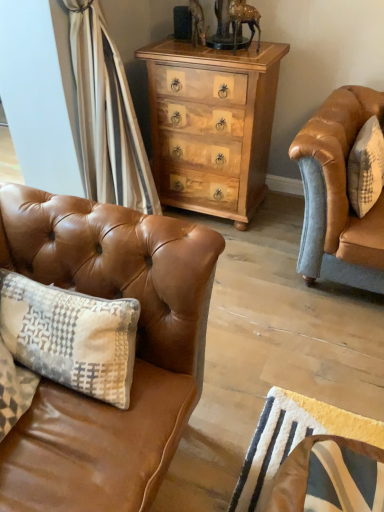
The image size is (384, 512). What do you see at coordinates (366, 167) in the screenshot?
I see `white textured pillow at right` at bounding box center [366, 167].

Describe the element at coordinates (136, 350) in the screenshot. I see `saddle brown leather couch at left` at that location.

What are the coordinates of `white textured pillow at right` in the screenshot? It's located at (366, 167).

Visually, is leather swivel chair at lower right positioned to the left or to the right of white textured pillow at right?

leather swivel chair at lower right is positioned on white textured pillow at right's left side.

Does point (344, 482) come closer to viewer compared to point (370, 187)?

Yes.

Does leather swivel chair at lower right have a lesser height compared to white textured pillow at right?

In fact, leather swivel chair at lower right may be taller than white textured pillow at right.

Can you tell me how much leather swivel chair at lower right and white textured pillow at right differ in facing direction?

4.36 degrees.

Is white textured pillow at right next to saddle brown leather couch at left?

white textured pillow at right is not next to saddle brown leather couch at left, and they're not touching.

Find the location of a particular element. The image size is (384, 512). studio couch lying on the left of white textured pillow at right is located at coordinates (136, 350).

Can you tell me how much white textured pillow at right and saddle brown leather couch at left differ in facing direction?

white textured pillow at right and saddle brown leather couch at left are facing 88.2 degrees away from each other.

Can saddle brown leather couch at left be found inside white textured pillow at right?

No, saddle brown leather couch at left is not surrounded by white textured pillow at right.

Which of these two, white textured pillow at right or light brown wood chest of drawers at center, is smaller?

white textured pillow at right is smaller.

Does point (363, 126) come farther from viewer compared to point (247, 187)?

That is False.

From a real-world perspective, relative to light brown wood chest of drawers at center, is white textured pillow at right vertically above or below?

In terms of real-world spatial position, white textured pillow at right is above light brown wood chest of drawers at center.

Which of these two, saddle brown leather couch at left or light brown wood chest of drawers at center, is thinner?

saddle brown leather couch at left.

Could you tell me if saddle brown leather couch at left is turned towards light brown wood chest of drawers at center?

No, saddle brown leather couch at left is not oriented towards light brown wood chest of drawers at center.

Does point (34, 279) come farther from viewer compared to point (265, 149)?

No, it is in front of (265, 149).

How distant is saddle brown leather couch at left from light brown wood chest of drawers at center?

4.06 feet.

Based on the photo, from the image's perspective, which object appears higher, light brown wood chest of drawers at center or white textured pillow at right?

light brown wood chest of drawers at center is shown above in the image.

From a real-world perspective, is light brown wood chest of drawers at center physically below white textured pillow at right?

Yes.

How many degrees apart are the facing directions of light brown wood chest of drawers at center and white textured pillow at right?

The angular difference between light brown wood chest of drawers at center and white textured pillow at right is 87.5 degrees.

Does light brown wood chest of drawers at center lie in front of saddle brown leather couch at left?

No, the depth of light brown wood chest of drawers at center is greater than that of saddle brown leather couch at left.

Considering the points (268, 42) and (85, 262), which point is in front, point (268, 42) or point (85, 262)?

The point (85, 262) is closer.

Is light brown wood chest of drawers at center facing away from saddle brown leather couch at left?

No, saddle brown leather couch at left is not at the back of light brown wood chest of drawers at center.

Who is bigger, light brown wood chest of drawers at center or saddle brown leather couch at left?

With larger size is light brown wood chest of drawers at center.

In the image, is light brown wood chest of drawers at center positioned in front of or behind leather swivel chair at lower right?

light brown wood chest of drawers at center is positioned farther from the viewer than leather swivel chair at lower right.

From the image's perspective, is light brown wood chest of drawers at center above or below leather swivel chair at lower right?

From the image's perspective, light brown wood chest of drawers at center appears above leather swivel chair at lower right.

Can you tell me how much light brown wood chest of drawers at center and leather swivel chair at lower right differ in facing direction?

91.9 degrees.

Is point (226, 57) closer to camera compared to point (286, 474)?

No, it is behind (286, 474).

The height and width of the screenshot is (512, 384). In order to click on pillow behind the leather swivel chair at lower right in this screenshot , I will do `click(366, 167)`.

Identify the location of studio couch in front of the white textured pillow at right. Image resolution: width=384 pixels, height=512 pixels. (136, 350).

Considering their positions, is leather swivel chair at lower right positioned closer to saddle brown leather couch at left than white textured pillow at right?

The object closer to saddle brown leather couch at left is leather swivel chair at lower right.

Estimate the real-world distances between objects in this image. Which object is further from white textured pillow at right, light brown wood chest of drawers at center or saddle brown leather couch at left?

Among the two, saddle brown leather couch at left is located further to white textured pillow at right.

Considering their positions, is saddle brown leather couch at left positioned closer to light brown wood chest of drawers at center than leather swivel chair at lower right?

saddle brown leather couch at left.

Estimate the real-world distances between objects in this image. Which object is further from leather swivel chair at lower right, light brown wood chest of drawers at center or saddle brown leather couch at left?

Among the two, light brown wood chest of drawers at center is located further to leather swivel chair at lower right.

Which object lies nearer to the anchor point white textured pillow at right, saddle brown leather couch at left or light brown wood chest of drawers at center?

Based on the image, light brown wood chest of drawers at center appears to be nearer to white textured pillow at right.

When comparing their distances from saddle brown leather couch at left, does light brown wood chest of drawers at center or white textured pillow at right seem closer?

The object closer to saddle brown leather couch at left is white textured pillow at right.

Looking at this image, based on their spatial positions, is saddle brown leather couch at left or leather swivel chair at lower right closer to white textured pillow at right?

The object closer to white textured pillow at right is saddle brown leather couch at left.

Which object lies further to the anchor point saddle brown leather couch at left, light brown wood chest of drawers at center or leather swivel chair at lower right?

light brown wood chest of drawers at center lies further to saddle brown leather couch at left than the other object.

Locate an element on the screen. This screenshot has height=512, width=384. the chest of drawers situated between saddle brown leather couch at left and white textured pillow at right from left to right is located at coordinates (212, 125).

Locate an element on the screen. The width and height of the screenshot is (384, 512). pillow that lies between light brown wood chest of drawers at center and leather swivel chair at lower right from top to bottom is located at coordinates (366, 167).

Find the location of a particular element. studio couch between light brown wood chest of drawers at center and leather swivel chair at lower right from top to bottom is located at coordinates (136, 350).

Identify the location of swivel chair between saddle brown leather couch at left and white textured pillow at right from left to right. This screenshot has height=512, width=384. (330, 477).